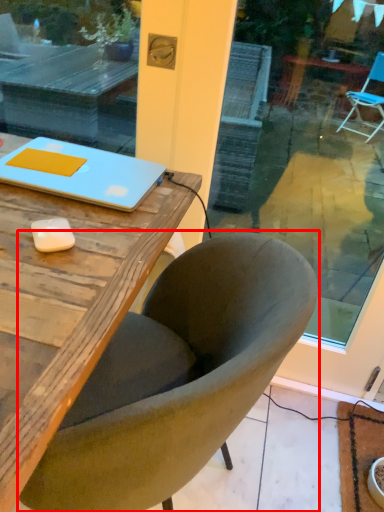
Question: From the image, what is the correct spatial relationship of chair (annotated by the red box) in relation to laptop?

Choices:
 (A) right
 (B) left

Answer: (A)